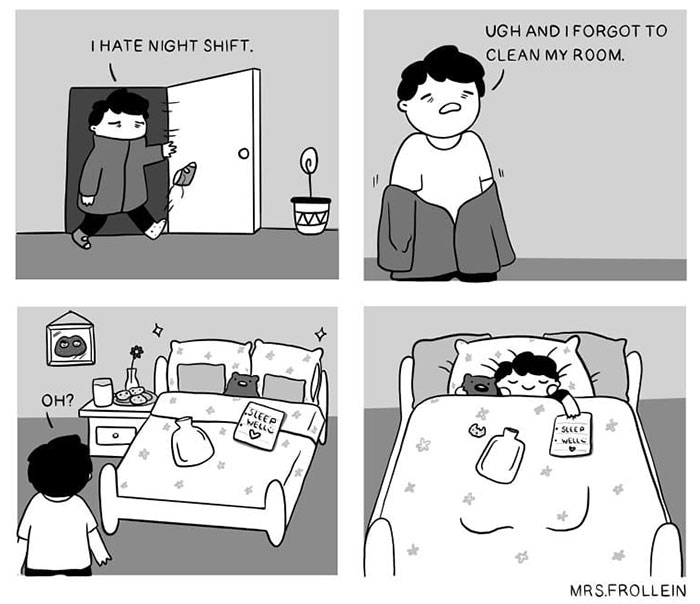
Identify the location of bed. The image size is (700, 604). (253, 466), (428, 484).